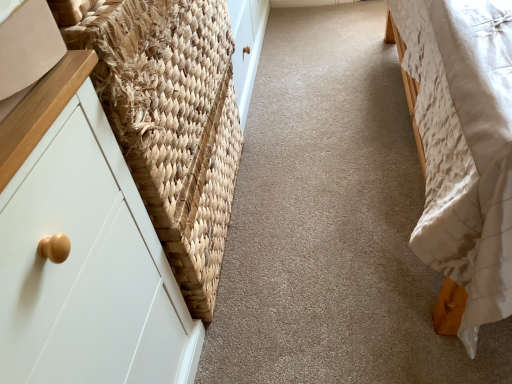
Question: Would you say white quilted fabric bed at right is inside or outside natural woven basket at left?

Choices:
 (A) inside
 (B) outside

Answer: (B)

Question: From their relative heights in the image, would you say white quilted fabric bed at right is taller or shorter than natural woven basket at left?

Choices:
 (A) tall
 (B) short

Answer: (A)

Question: Considering the positions of point (444, 173) and point (202, 261), is point (444, 173) closer or farther from the camera than point (202, 261)?

Choices:
 (A) closer
 (B) farther

Answer: (A)

Question: From a real-world perspective, is natural woven basket at left positioned above or below white quilted fabric bed at right?

Choices:
 (A) below
 (B) above

Answer: (B)

Question: Relative to white quilted fabric bed at right, is natural woven basket at left in front or behind?

Choices:
 (A) behind
 (B) front

Answer: (A)

Question: Considering the positions of natural woven basket at left and white quilted fabric bed at right in the image, is natural woven basket at left taller or shorter than white quilted fabric bed at right?

Choices:
 (A) tall
 (B) short

Answer: (B)

Question: Is point (152, 190) closer or farther from the camera than point (437, 221)?

Choices:
 (A) farther
 (B) closer

Answer: (B)